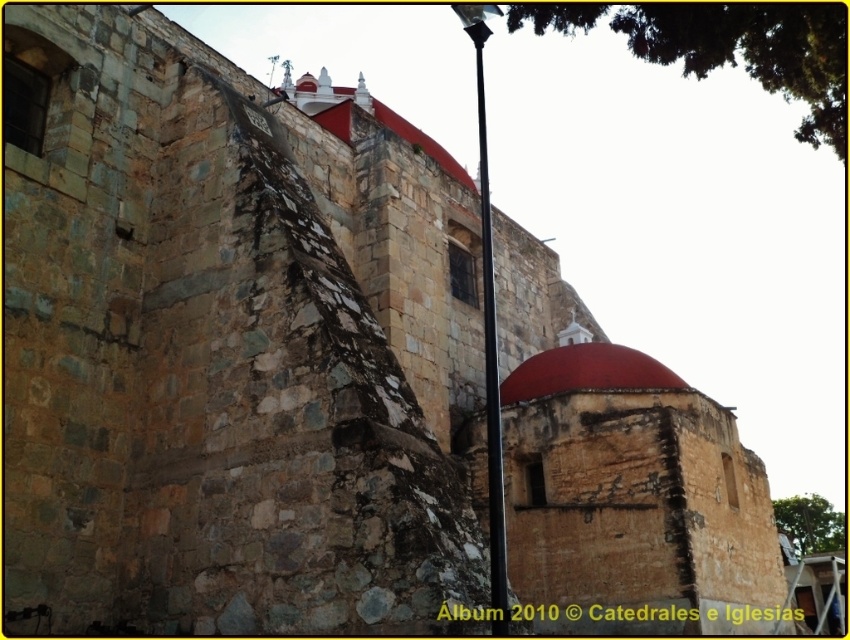
Which is in front, point (763, 561) or point (670, 388)?

Positioned in front is point (670, 388).

Does smooth stone dome at center have a lesser width compared to red stone dome at center?

Incorrect, smooth stone dome at center's width is not less than red stone dome at center's.

What do you see at coordinates (629, 486) in the screenshot? Image resolution: width=850 pixels, height=640 pixels. I see `smooth stone dome at center` at bounding box center [629, 486].

In order to click on smooth stone dome at center in this screenshot , I will do `click(629, 486)`.